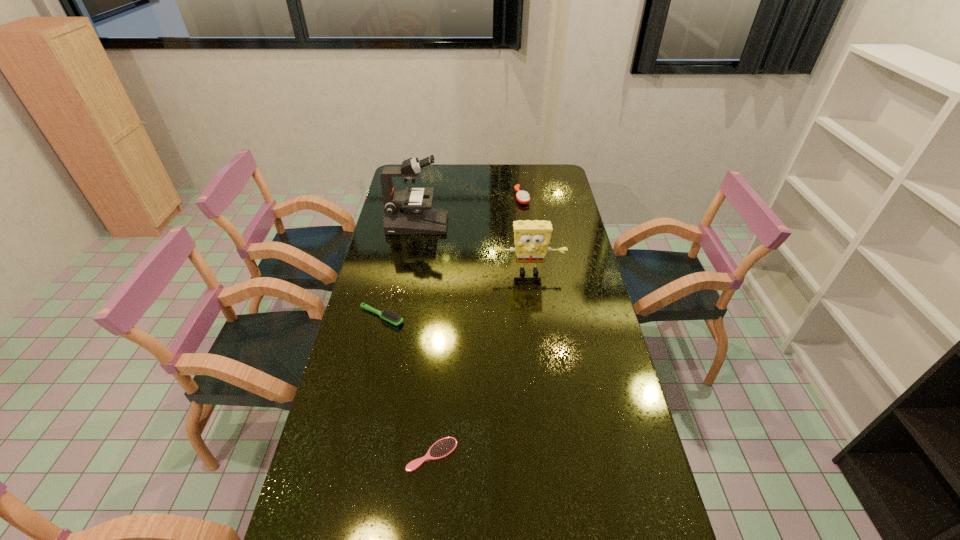
Identify the location of microscope. (406, 212).

Where is `the tallest object`? The image size is (960, 540). the tallest object is located at coordinates (406, 212).

What are the coordinates of `the second tallest object` in the screenshot? It's located at (531, 238).

The image size is (960, 540). Find the location of `the third nearest object`. the third nearest object is located at coordinates (531, 238).

This screenshot has width=960, height=540. I want to click on the tallest hairbrush, so click(522, 197).

Identify the location of the farthest hairbrush. The width and height of the screenshot is (960, 540). (522, 197).

At what (x,y) coordinates should I click in order to perform the action: click on the second farthest hairbrush. Please return your answer as a coordinate pair (x, y). The image size is (960, 540). Looking at the image, I should click on (389, 316).

Where is `the fourth tallest object`? This screenshot has height=540, width=960. the fourth tallest object is located at coordinates (389, 316).

Locate an element on the screen. This screenshot has width=960, height=540. the shortest object is located at coordinates (442, 448).

Where is `the second hairbrush from right to left`? the second hairbrush from right to left is located at coordinates (442, 448).